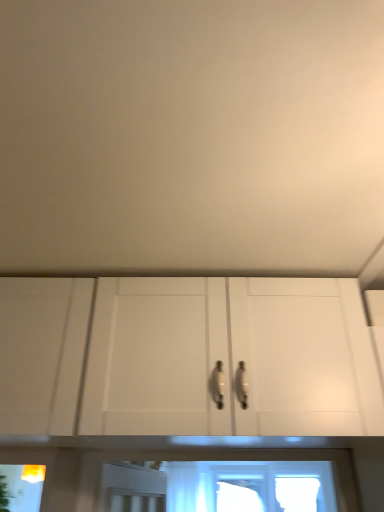
Question: Is white matte cabinet at center shorter than yellow plastic light fixture at lower left?

Choices:
 (A) yes
 (B) no

Answer: (B)

Question: From the image's perspective, is white matte cabinet at center on top of yellow plastic light fixture at lower left?

Choices:
 (A) yes
 (B) no

Answer: (A)

Question: From the image's perspective, is white matte cabinet at center below yellow plastic light fixture at lower left?

Choices:
 (A) no
 (B) yes

Answer: (A)

Question: Does white matte cabinet at center turn towards yellow plastic light fixture at lower left?

Choices:
 (A) yes
 (B) no

Answer: (B)

Question: Considering the relative sizes of white matte cabinet at center and yellow plastic light fixture at lower left in the image provided, is white matte cabinet at center smaller than yellow plastic light fixture at lower left?

Choices:
 (A) no
 (B) yes

Answer: (A)

Question: Based on their sizes in the image, would you say white matte cabinet at center is bigger or smaller than yellow plastic light fixture at lower left?

Choices:
 (A) big
 (B) small

Answer: (A)

Question: Is point (180, 422) positioned closer to the camera than point (44, 472)?

Choices:
 (A) closer
 (B) farther

Answer: (A)

Question: Is white matte cabinet at center wider or thinner than yellow plastic light fixture at lower left?

Choices:
 (A) thin
 (B) wide

Answer: (B)

Question: In the image, is white matte cabinet at center positioned in front of or behind yellow plastic light fixture at lower left?

Choices:
 (A) behind
 (B) front

Answer: (B)

Question: Is white matte cabinet at center inside or outside of green leafy plant at lower left?

Choices:
 (A) outside
 (B) inside

Answer: (A)

Question: Visually, is white matte cabinet at center positioned to the left or to the right of green leafy plant at lower left?

Choices:
 (A) left
 (B) right

Answer: (B)

Question: From the image's perspective, is white matte cabinet at center located above or below green leafy plant at lower left?

Choices:
 (A) above
 (B) below

Answer: (A)

Question: From a real-world perspective, is white matte cabinet at center positioned above or below green leafy plant at lower left?

Choices:
 (A) below
 (B) above

Answer: (B)

Question: Considering their positions, is green leafy plant at lower left located in front of or behind white matte cabinet at center?

Choices:
 (A) front
 (B) behind

Answer: (B)

Question: From their relative heights in the image, would you say green leafy plant at lower left is taller or shorter than white matte cabinet at center?

Choices:
 (A) tall
 (B) short

Answer: (A)